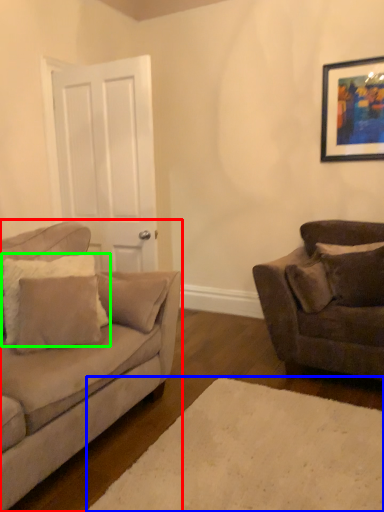
Question: Based on their relative distances, which object is nearer to studio couch (highlighted by a red box)? Choose from plain (highlighted by a blue box) and pillow (highlighted by a green box).

Choices:
 (A) plain
 (B) pillow

Answer: (B)